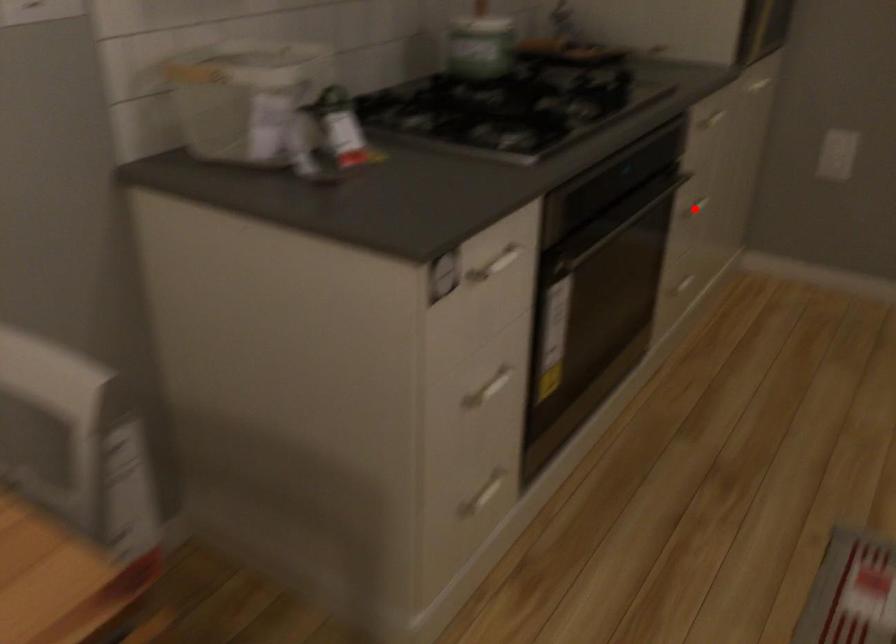
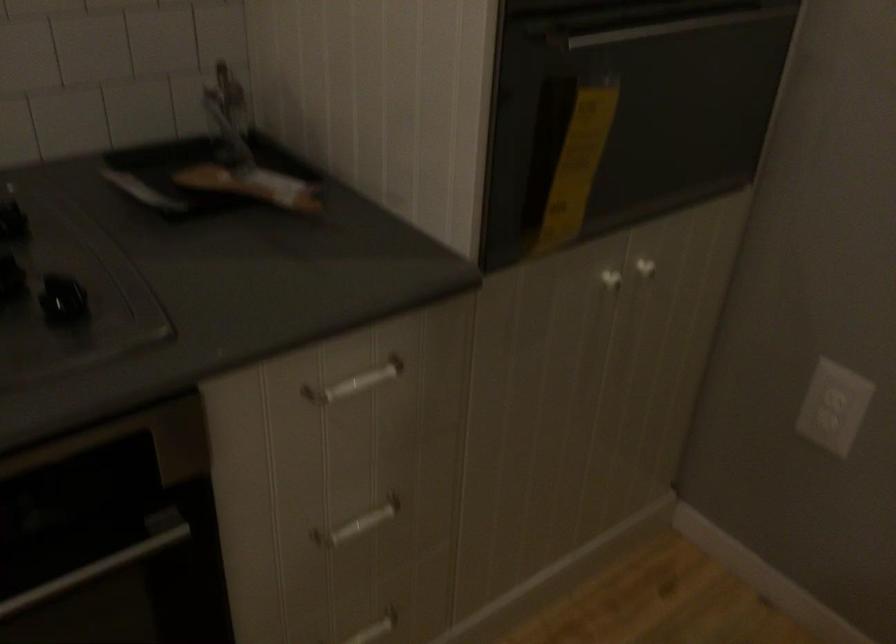
Question: I am providing you with two images of the same scene from different viewpoints. In image1, a red point is highlighted. Considering the same 3D point in image2, which of the following is correct?

Choices:
 (A) It is closer
 (B) It is farther

Answer: (A)